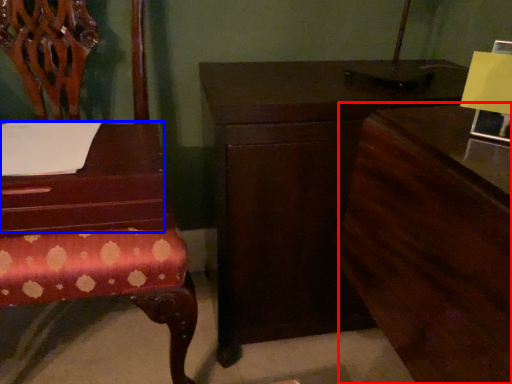
Question: Among these objects, which one is nearest to the camera, dresser (highlighted by a red box) or table (highlighted by a blue box)?

Choices:
 (A) dresser
 (B) table

Answer: (A)